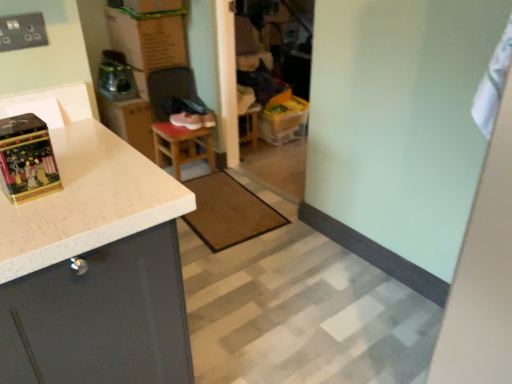
Question: Does brown textured mat at center have a lesser width compared to cardboard box at upper center?

Choices:
 (A) yes
 (B) no

Answer: (B)

Question: Considering the relative sizes of brown textured mat at center and cardboard box at upper center in the image provided, is brown textured mat at center bigger than cardboard box at upper center?

Choices:
 (A) yes
 (B) no

Answer: (B)

Question: Is brown textured mat at center closer to the viewer compared to cardboard box at upper center?

Choices:
 (A) yes
 (B) no

Answer: (A)

Question: Is brown textured mat at center in contact with cardboard box at upper center?

Choices:
 (A) no
 (B) yes

Answer: (A)

Question: From a real-world perspective, is brown textured mat at center physically below cardboard box at upper center?

Choices:
 (A) no
 (B) yes

Answer: (B)

Question: Considering the positions of pink suede shoe at center and gold metallic box at left in the image, is pink suede shoe at center taller or shorter than gold metallic box at left?

Choices:
 (A) tall
 (B) short

Answer: (B)

Question: Relative to gold metallic box at left, is pink suede shoe at center in front or behind?

Choices:
 (A) front
 (B) behind

Answer: (B)

Question: Does point (181, 122) appear closer or farther from the camera than point (44, 145)?

Choices:
 (A) closer
 (B) farther

Answer: (B)

Question: From a real-world perspective, is pink suede shoe at center physically located above or below gold metallic box at left?

Choices:
 (A) above
 (B) below

Answer: (B)

Question: Considering the positions of brown textured mat at center and cardboard box at upper center in the image, is brown textured mat at center taller or shorter than cardboard box at upper center?

Choices:
 (A) tall
 (B) short

Answer: (B)

Question: Considering their positions, is brown textured mat at center located in front of or behind cardboard box at upper center?

Choices:
 (A) behind
 (B) front

Answer: (B)

Question: From the image's perspective, is brown textured mat at center located above or below cardboard box at upper center?

Choices:
 (A) above
 (B) below

Answer: (B)

Question: Is brown textured mat at center wider or thinner than cardboard box at upper center?

Choices:
 (A) wide
 (B) thin

Answer: (A)

Question: In the image, is brown textured mat at center positioned in front of or behind wooden stool at center?

Choices:
 (A) front
 (B) behind

Answer: (A)

Question: Choose the correct answer: Is brown textured mat at center inside wooden stool at center or outside it?

Choices:
 (A) inside
 (B) outside

Answer: (B)